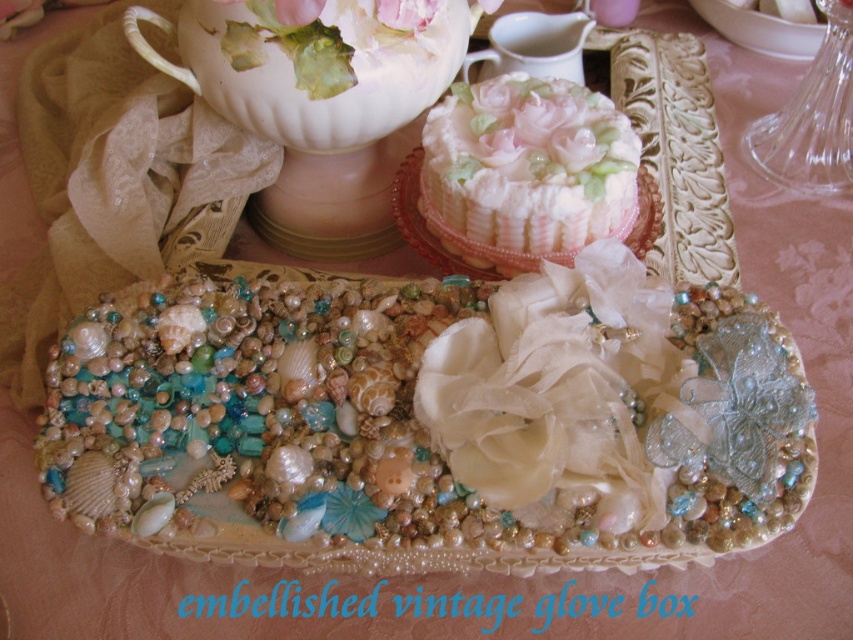
Question: Which point is farther from the camera taking this photo?

Choices:
 (A) (550, 19)
 (B) (598, 92)
 (C) (415, 3)

Answer: (B)

Question: Can you confirm if white frosting cake at center is positioned to the left of matte porcelain teacup at upper center?

Choices:
 (A) yes
 (B) no

Answer: (B)

Question: Is white frosting cake at center further to camera compared to pink fabric flower at center?

Choices:
 (A) yes
 (B) no

Answer: (A)

Question: Estimate the real-world distances between objects in this image. Which object is closer to the white frosting cake at center?

Choices:
 (A) matte porcelain teacup at upper center
 (B) pink fabric flower at center

Answer: (A)

Question: Which object appears closest to the camera in this image?

Choices:
 (A) white frosting cake at center
 (B) matte porcelain teacup at upper center

Answer: (A)

Question: Is matte porcelain teacup at upper center thinner than pink fabric flower at center?

Choices:
 (A) yes
 (B) no

Answer: (B)